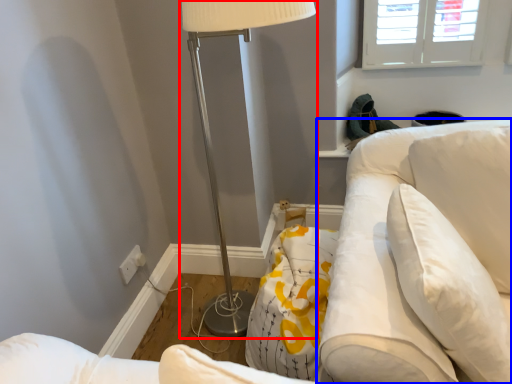
Question: Which object is closer to the camera taking this photo, lamp (highlighted by a red box) or swivel chair (highlighted by a blue box)?

Choices:
 (A) lamp
 (B) swivel chair

Answer: (A)